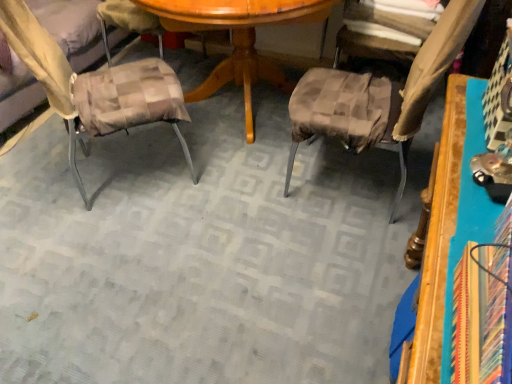
I want to click on brown checkered cushion at center, the second chair from the left, so click(x=378, y=96).

Describe the element at coordinates (95, 87) in the screenshot. I see `plaid fabric cushion at left, the second chair from the right` at that location.

This screenshot has height=384, width=512. I want to click on wooden table at right, so (448, 229).

From the image's perspective, which one is positioned higher, brown checkered cushion at center, the second chair from the left, or plaid fabric cushion at left, the second chair from the right?

plaid fabric cushion at left, the second chair from the right, from the image's perspective.

Would you say brown checkered cushion at center, the second chair from the left, is to the left or to the right of plaid fabric cushion at left, the 1th chair positioned from the left, in the picture?

From the image, it's evident that brown checkered cushion at center, the second chair from the left, is to the right of plaid fabric cushion at left, the 1th chair positioned from the left.

Does brown checkered cushion at center, the second chair from the left, have a greater height compared to plaid fabric cushion at left, the 1th chair positioned from the left?

Yes.

Considering the sizes of objects wooden table at right and brown textured fabric at upper right in the image provided, who is shorter, wooden table at right or brown textured fabric at upper right?

brown textured fabric at upper right.

From the image's perspective, would you say wooden table at right is positioned over brown textured fabric at upper right?

Incorrect, from the image's perspective, wooden table at right is lower than brown textured fabric at upper right.

Would you say brown textured fabric at upper right is part of wooden table at right's contents?

Definitely not — brown textured fabric at upper right is not inside wooden table at right.

Are wooden table at right and brown textured fabric at upper right located far from each other?

wooden table at right is near brown textured fabric at upper right, not far away.

From the picture: Could you tell me if brown textured fabric at upper right is facing plaid fabric cushion at left, the second chair from the right?

Yes, brown textured fabric at upper right is turned towards plaid fabric cushion at left, the second chair from the right.

From the picture: Is brown textured fabric at upper right next to plaid fabric cushion at left, the second chair from the right?

No, brown textured fabric at upper right is not next to plaid fabric cushion at left, the second chair from the right.

From a real-world perspective, relative to plaid fabric cushion at left, the second chair from the right, is brown textured fabric at upper right vertically above or below?

From a real-world perspective, brown textured fabric at upper right is physically above plaid fabric cushion at left, the second chair from the right.

Based on the photo, which of these two, brown textured fabric at upper right or plaid fabric cushion at left, the 1th chair positioned from the left, stands taller?

With more height is plaid fabric cushion at left, the 1th chair positioned from the left.

Based on their positions, is brown textured fabric at upper right located to the left or right of brown checkered cushion at center, placed as the 1th chair when sorted from right to left?

Clearly, brown textured fabric at upper right is on the right of brown checkered cushion at center, placed as the 1th chair when sorted from right to left, in the image.

Where is `fabric lying on the right of brown checkered cushion at center, placed as the 1th chair when sorted from right to left`? This screenshot has height=384, width=512. fabric lying on the right of brown checkered cushion at center, placed as the 1th chair when sorted from right to left is located at coordinates (434, 63).

Is brown textured fabric at upper right not inside brown checkered cushion at center, placed as the 1th chair when sorted from right to left?

That's correct, brown textured fabric at upper right is outside of brown checkered cushion at center, placed as the 1th chair when sorted from right to left.

Which of these two, wooden table at right or plaid fabric cushion at left, the 1th chair positioned from the left, is bigger?

Bigger between the two is plaid fabric cushion at left, the 1th chair positioned from the left.

I want to click on chair below the wooden table at right (from a real-world perspective), so click(x=95, y=87).

How many degrees apart are the facing directions of wooden table at right and plaid fabric cushion at left, the 1th chair positioned from the left?

wooden table at right and plaid fabric cushion at left, the 1th chair positioned from the left, are facing 180 degrees away from each other.

Considering the sizes of objects wooden table at right and plaid fabric cushion at left, the 1th chair positioned from the left, in the image provided, who is taller, wooden table at right or plaid fabric cushion at left, the 1th chair positioned from the left,?

wooden table at right is taller.

Can you see brown checkered cushion at center, the second chair from the left, touching brown textured fabric at upper right?

Yes, brown checkered cushion at center, the second chair from the left, and brown textured fabric at upper right clearly make contact.

Does brown checkered cushion at center, the second chair from the left, have a greater height compared to brown textured fabric at upper right?

Yes, brown checkered cushion at center, the second chair from the left, is taller than brown textured fabric at upper right.

Does brown checkered cushion at center, placed as the 1th chair when sorted from right to left, contain brown textured fabric at upper right?

Actually, brown textured fabric at upper right is outside brown checkered cushion at center, placed as the 1th chair when sorted from right to left.

Does plaid fabric cushion at left, the second chair from the right, have a lesser height compared to brown textured fabric at upper right?

No.

From a real-world perspective, which object rests below the other?

In real-world perspective, plaid fabric cushion at left, the second chair from the right, is lower.

Looking at this image, is plaid fabric cushion at left, the second chair from the right, oriented towards brown textured fabric at upper right?

Yes, plaid fabric cushion at left, the second chair from the right, is turned towards brown textured fabric at upper right.

Which object is wider, plaid fabric cushion at left, the 1th chair positioned from the left, or brown textured fabric at upper right?

Wider between the two is plaid fabric cushion at left, the 1th chair positioned from the left.

You are a GUI agent. You are given a task and a screenshot of the screen. Output one action in this format:
    pyautogui.click(x=<x>, y=<y>)
    Task: Click on the chair on the right of plaid fabric cushion at left, the second chair from the right
    
    Given the screenshot: What is the action you would take?
    pyautogui.click(x=378, y=96)

I want to click on table on the left side of brown textured fabric at upper right, so click(x=448, y=229).

Based on their spatial positions, is brown checkered cushion at center, the second chair from the left, or brown textured fabric at upper right further from wooden table at right?

brown checkered cushion at center, the second chair from the left, is further to wooden table at right.

When comparing their distances from brown textured fabric at upper right, does wooden table at right or plaid fabric cushion at left, the 1th chair positioned from the left, seem closer?

wooden table at right.

Based on their spatial positions, is brown textured fabric at upper right or plaid fabric cushion at left, the 1th chair positioned from the left, further from wooden table at right?

plaid fabric cushion at left, the 1th chair positioned from the left, lies further to wooden table at right than the other object.

Based on their spatial positions, is brown textured fabric at upper right or brown checkered cushion at center, the second chair from the left, further from plaid fabric cushion at left, the 1th chair positioned from the left?

Based on the image, brown textured fabric at upper right appears to be further to plaid fabric cushion at left, the 1th chair positioned from the left.

When comparing their distances from brown textured fabric at upper right, does brown checkered cushion at center, the second chair from the left, or wooden table at right seem closer?

brown checkered cushion at center, the second chair from the left.

In the scene shown: Looking at the image, which one is located closer to brown checkered cushion at center, placed as the 1th chair when sorted from right to left, plaid fabric cushion at left, the 1th chair positioned from the left, or wooden table at right?

Based on the image, wooden table at right appears to be nearer to brown checkered cushion at center, placed as the 1th chair when sorted from right to left.

Which object lies further to the anchor point brown checkered cushion at center, the second chair from the left, brown textured fabric at upper right or wooden table at right?

wooden table at right.

Considering their positions, is wooden table at right positioned closer to plaid fabric cushion at left, the second chair from the right, than brown textured fabric at upper right?

brown textured fabric at upper right lies closer to plaid fabric cushion at left, the second chair from the right, than the other object.

Locate an element on the screen. Image resolution: width=512 pixels, height=384 pixels. table between plaid fabric cushion at left, the 1th chair positioned from the left, and brown textured fabric at upper right from left to right is located at coordinates (448, 229).

Where is `chair between plaid fabric cushion at left, the second chair from the right, and brown textured fabric at upper right from left to right`? This screenshot has width=512, height=384. chair between plaid fabric cushion at left, the second chair from the right, and brown textured fabric at upper right from left to right is located at coordinates (378, 96).

This screenshot has height=384, width=512. In order to click on chair between plaid fabric cushion at left, the 1th chair positioned from the left, and wooden table at right in this screenshot , I will do `click(378, 96)`.